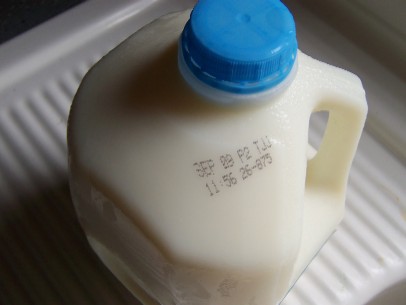
Locate an element on the screen. Image resolution: width=406 pixels, height=305 pixels. shadow of milk jug on white shelf is located at coordinates (39, 270).